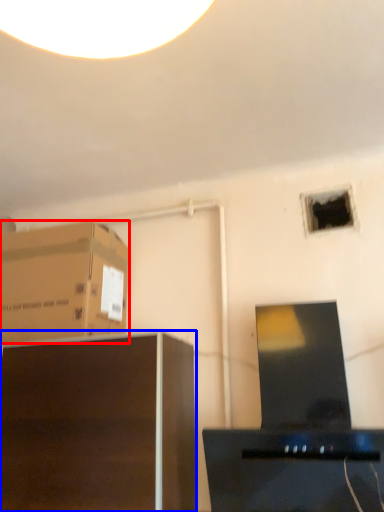
Question: Among these objects, which one is farthest to the camera, cardboard box (highlighted by a red box) or furniture (highlighted by a blue box)?

Choices:
 (A) cardboard box
 (B) furniture

Answer: (A)